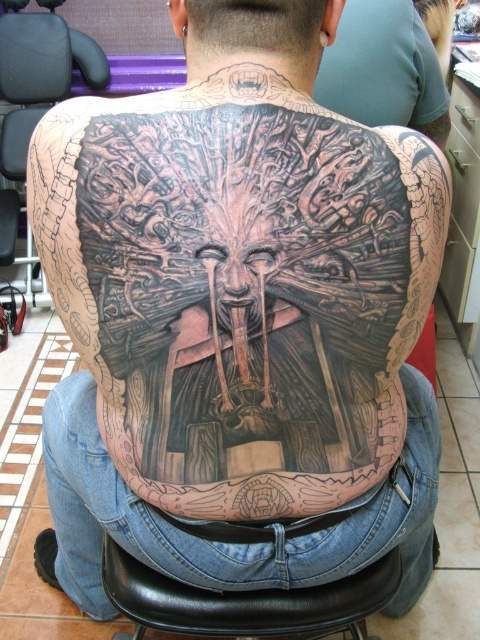
This screenshot has width=480, height=640. Find the location of `black tattooed skin at center`. black tattooed skin at center is located at coordinates (384, 68).

What are the coordinates of `black tattooed skin at center` in the screenshot? It's located at (384, 68).

Between black leather chair at lower center and black tattooed skin at center, which one appears on the right side from the viewer's perspective?

black tattooed skin at center is more to the right.

Is black leather chair at lower center closer to the viewer compared to black tattooed skin at center?

Yes.

I want to click on black leather chair at lower center, so click(x=244, y=602).

Consider the image. Does black leather chair at lower center appear on the right side of black leather chair at upper left?

Indeed, black leather chair at lower center is positioned on the right side of black leather chair at upper left.

Measure the distance between black leather chair at lower center and black leather chair at upper left.

black leather chair at lower center is 2.00 meters away from black leather chair at upper left.

Between point (277, 611) and point (75, 38), which one is positioned behind?

The point (75, 38) is more distant.

What are the coordinates of `black leather chair at lower center` in the screenshot? It's located at (244, 602).